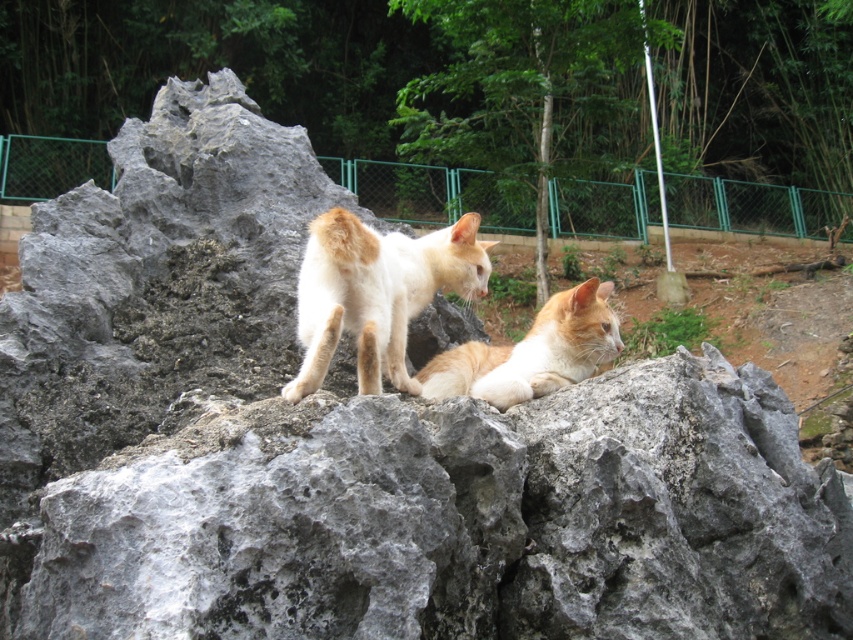
Which is behind, point (848, 196) or point (405, 387)?

The point (848, 196) is more distant.

Which is above, green metal fence at upper center or white fur cat at center?

green metal fence at upper center

Which is behind, point (421, 221) or point (314, 339)?

Positioned behind is point (421, 221).

Where is `green metal fence at upper center`? The image size is (853, 640). green metal fence at upper center is located at coordinates (430, 193).

Can you confirm if green metal fence at upper center is wider than orange fur cat at center?

In fact, green metal fence at upper center might be narrower than orange fur cat at center.

Who is taller, green metal fence at upper center or orange fur cat at center?

Standing taller between the two is green metal fence at upper center.

Does point (74, 166) lie in front of point (550, 317)?

No, (74, 166) is further to viewer.

Where is `green metal fence at upper center`? green metal fence at upper center is located at coordinates (430, 193).

Does green metal fence at upper center have a smaller size compared to green wire mesh fence at center?

Yes, green metal fence at upper center is smaller than green wire mesh fence at center.

Between green metal fence at upper center and green wire mesh fence at center, which one is positioned higher?

green metal fence at upper center is above.

The image size is (853, 640). I want to click on green metal fence at upper center, so click(x=430, y=193).